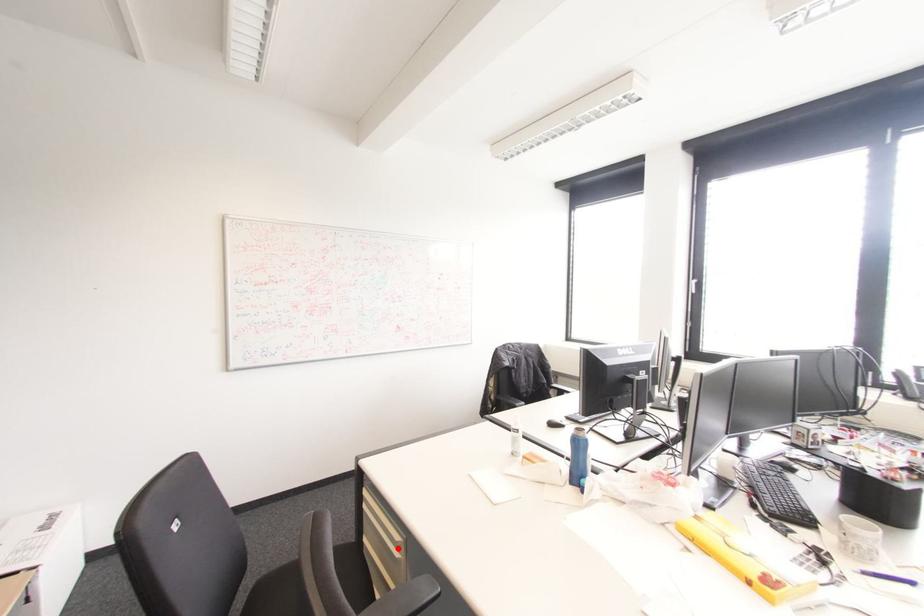
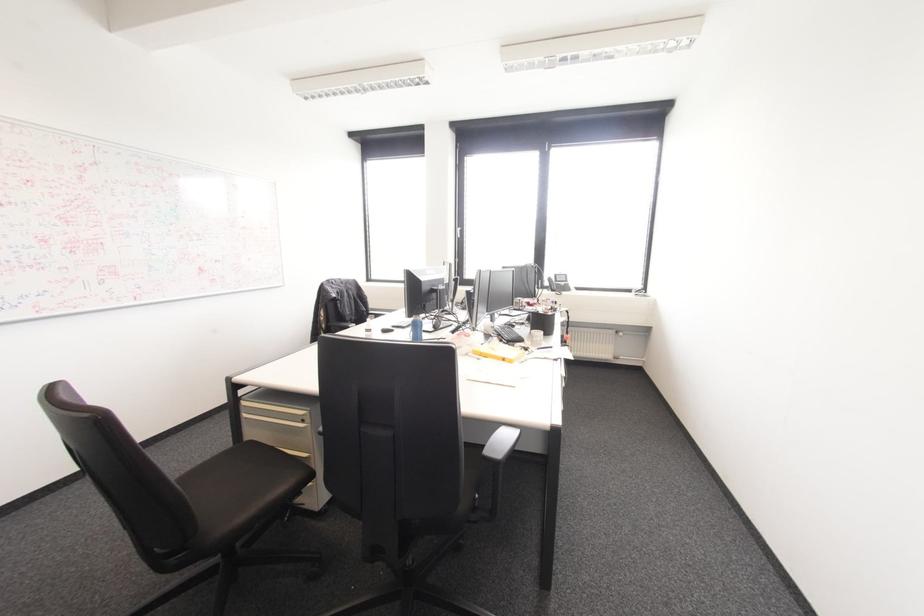
Question: A red point is marked in image1. In image2, is the corresponding 3D point closer to the camera or farther? Reply with the corresponding letter.

Choices:
 (A) The corresponding 3D point is closer.
 (B) The corresponding 3D point is farther.

Answer: (B)